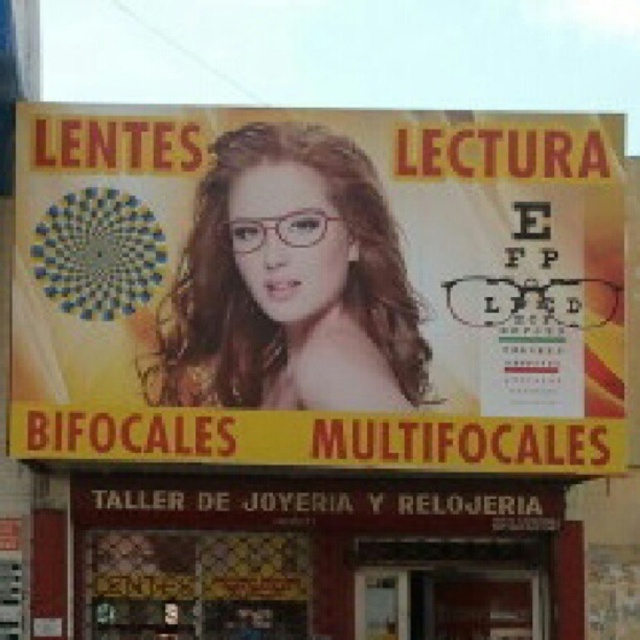
You are a customer standing in front of the eyewear store advertisement. You notice the matte plastic glasses at upper center. Where exactly on the signboard is the matte plastic glasses located?

The matte plastic glasses at upper center is located at point [317,288] on the signboard.

You are a customer looking at the eyewear advertisement. You see the matte plastic glasses at upper center and the matte pink glasses at center. Which one is positioned to the right of the other?

The matte plastic glasses at upper center is to the right of the matte pink glasses at center.